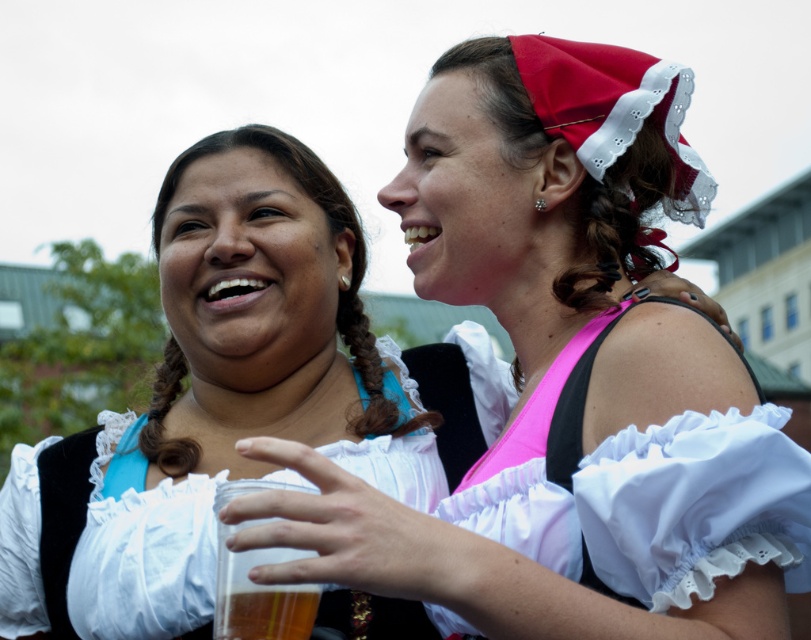
Looking at this image, is pink satin dress at upper right above translucent plastic cup at center?

Indeed, pink satin dress at upper right is positioned over translucent plastic cup at center.

Between pink satin dress at upper right and translucent plastic cup at center, which one appears on the right side from the viewer's perspective?

pink satin dress at upper right is more to the right.

This screenshot has height=640, width=811. Identify the location of pink satin dress at upper right. (642, 492).

Who is positioned more to the right, matte white blouse at upper center or translucent plastic cup at center?

matte white blouse at upper center

Is point (573, 531) less distant than point (295, 484)?

That is True.

You are a GUI agent. You are given a task and a screenshot of the screen. Output one action in this format:
    pyautogui.click(x=<x>, y=<y>)
    Task: Click on the matte white blouse at upper center
    The width and height of the screenshot is (811, 640).
    Given the screenshot: What is the action you would take?
    (x=565, y=378)

Find the location of a particular element. matte white blouse at upper center is located at coordinates (565, 378).

Which is behind, point (464, 298) or point (543, 461)?

The point (464, 298) is behind.

Who is more forward, (676,529) or (732,548)?

Point (676,529) is in front.

The height and width of the screenshot is (640, 811). Find the location of `matte white blouse at upper center`. matte white blouse at upper center is located at coordinates (565, 378).